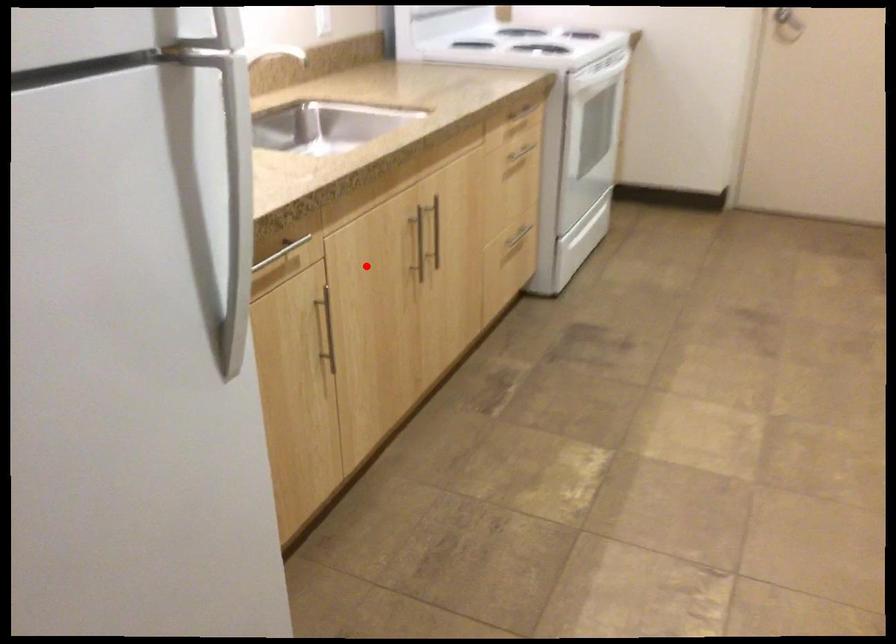
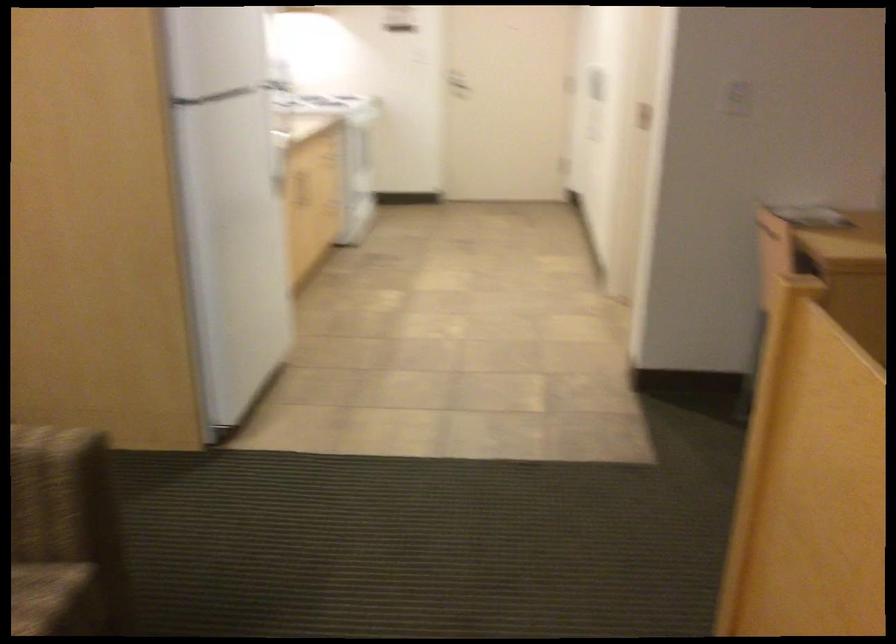
Question: I am providing you with two images of the same scene from different viewpoints. Given a red point in image1, look at the same physical point in image2. Is it:

Choices:
 (A) Closer to the viewpoint
 (B) Farther from the viewpoint

Answer: (B)